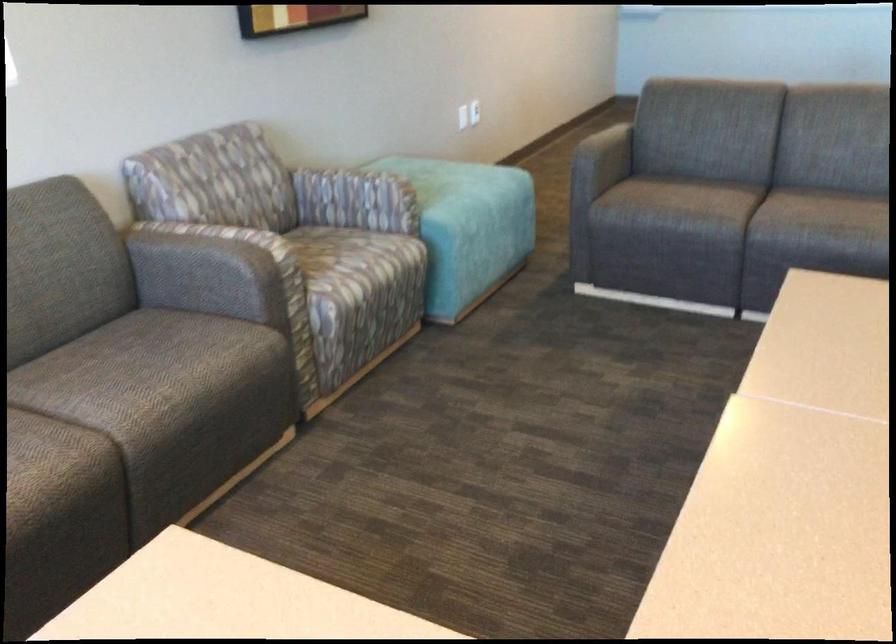
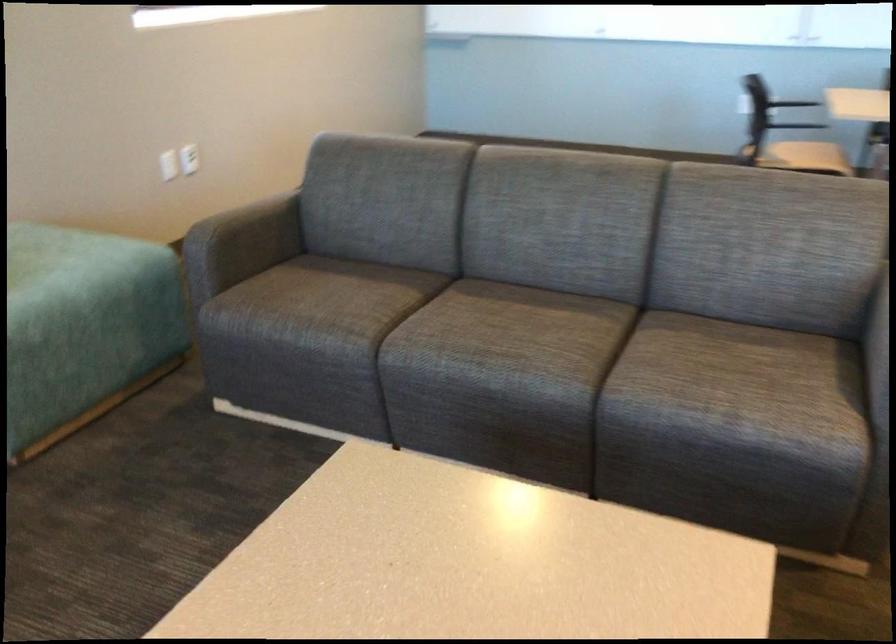
The images are taken continuously from a first-person perspective. In which direction are you moving?

The movement direction of the cameraman is right, forward.